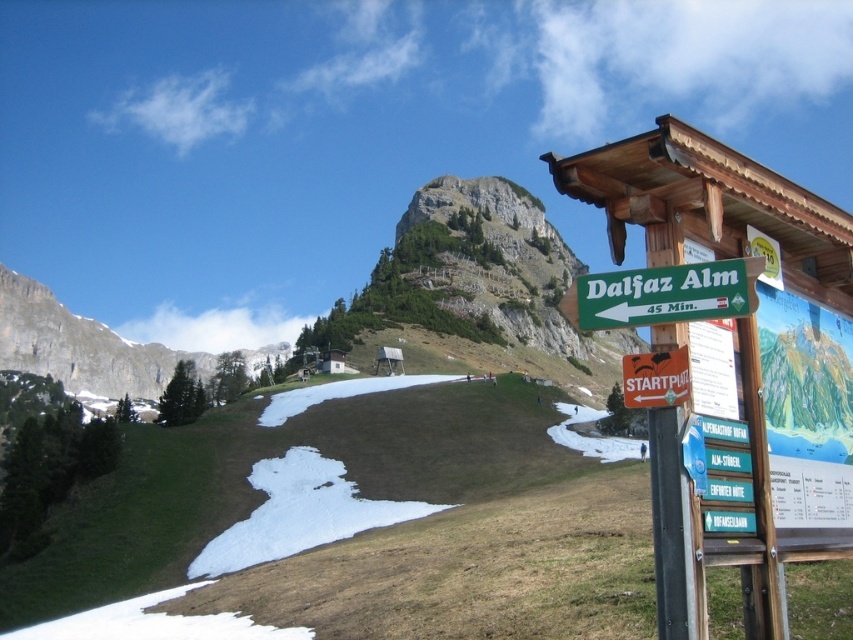
Looking at this image, you are a hiker planning to take a photo of both the wooden signpost at upper right and the rocky gray mountain at upper left. Based on their sizes in the image, which object would appear smaller in the photo?

The wooden signpost at upper right has a lesser width compared to the rocky gray mountain at upper left, so it would appear smaller in the photo.

You are standing at the wooden signpost at upper right and want to take a photo of the rocky gray mountain at upper left. Which direction should you face to capture the mountain in your camera?

You should face to the left because the rocky gray mountain at upper left is located to the left of the wooden signpost at upper right.